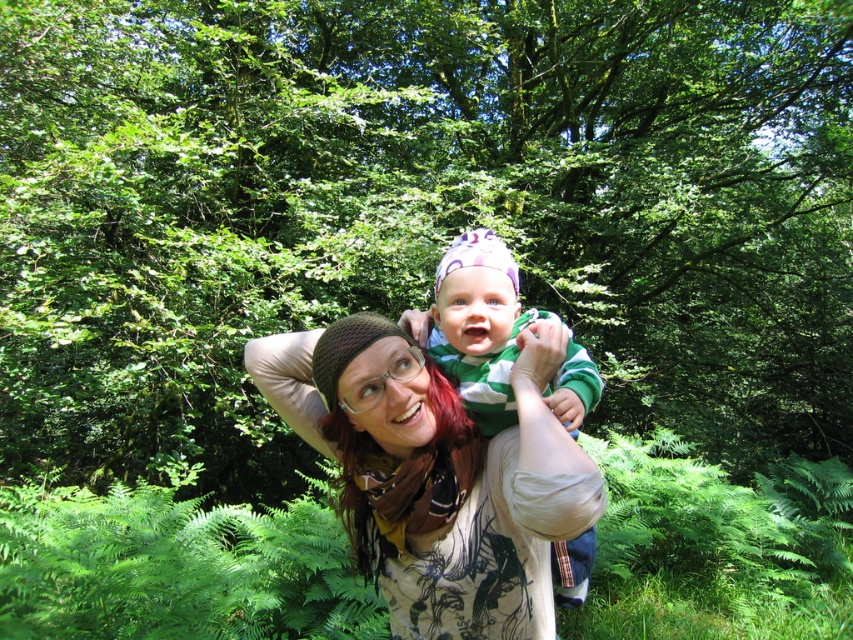
In the forest scene, there is a woman wearing a matte brown knitted hat at center and a baby on her back. If you were standing at the point marked as point [434,474], which object would you be pointing at?

The point [434,474] corresponds to the matte brown knitted hat at center.

You are standing in the forest and want to place a 1.2 meter long wooden bench. The point where you want to place it is at coordinates point (525,534). Given that the distance between you and the point is 1.53 meters, can you fit the bench there without moving closer?

The distance between you and point (525,534) is 1.53 meters. Since the bench is 1.2 meters long, which is shorter than the distance to the point, you can fit the bench there without moving closer.

You are a photographer trying to capture the matte brown knitted hat at center in a closeup shot. The camera has a focal length of 50mm and an aperture of f2.8. The hat is located at coordinates point 0.741, 0.510. If you want to focus on the hat, which part of the image should you adjust your focus to?

You should adjust your focus to the matte brown knitted hat at center located at point (434,474) to ensure it is in sharp focus.